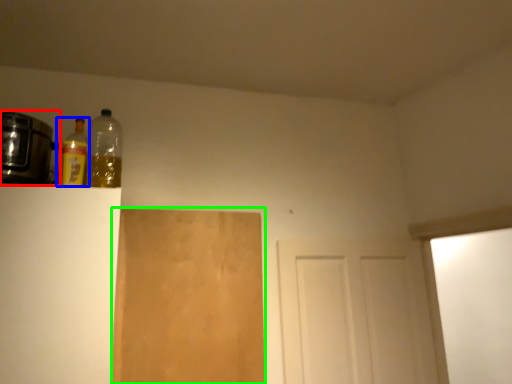
Question: Considering the real-world distances, which object is closest to appliance (highlighted by a red box)? bottle (highlighted by a blue box) or plywood (highlighted by a green box).

Choices:
 (A) bottle
 (B) plywood

Answer: (A)